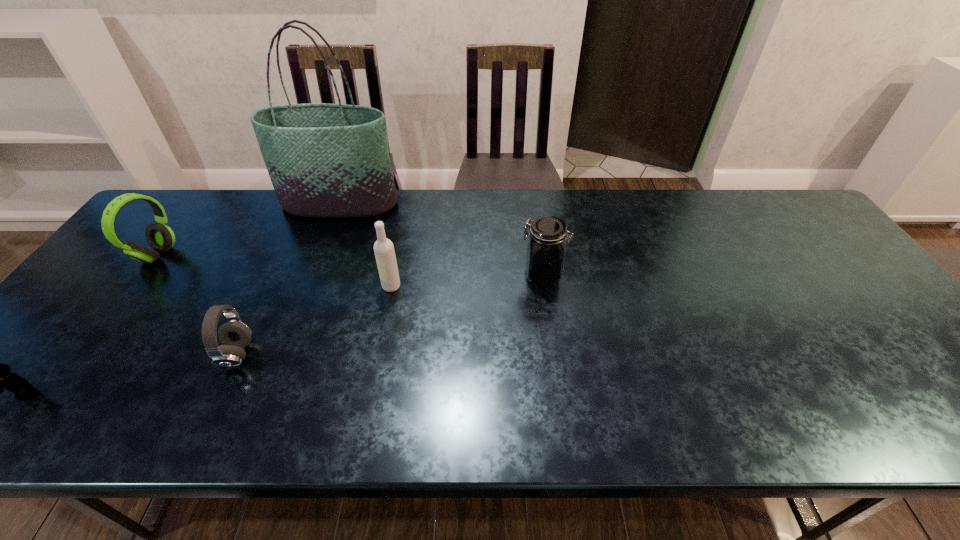
The height and width of the screenshot is (540, 960). What are the coordinates of `tote bag` in the screenshot? It's located at (324, 160).

What are the coordinates of `the tallest object` in the screenshot? It's located at (324, 160).

You are a GUI agent. You are given a task and a screenshot of the screen. Output one action in this format:
    pyautogui.click(x=<x>, y=<y>)
    Task: Click on the second object from right to left
    
    Given the screenshot: What is the action you would take?
    pyautogui.click(x=384, y=251)

This screenshot has height=540, width=960. Identify the location of the left headset. (160, 237).

The height and width of the screenshot is (540, 960). Identify the location of the farther headset. (160, 237).

Identify the location of jar. This screenshot has height=540, width=960. (545, 255).

Find the location of `the right headset`. the right headset is located at coordinates (234, 335).

The width and height of the screenshot is (960, 540). Identify the location of the fifth farthest object. (234, 335).

The width and height of the screenshot is (960, 540). I want to click on the nearest object, so click(x=0, y=376).

The image size is (960, 540). Identify the location of Lego. (0, 376).